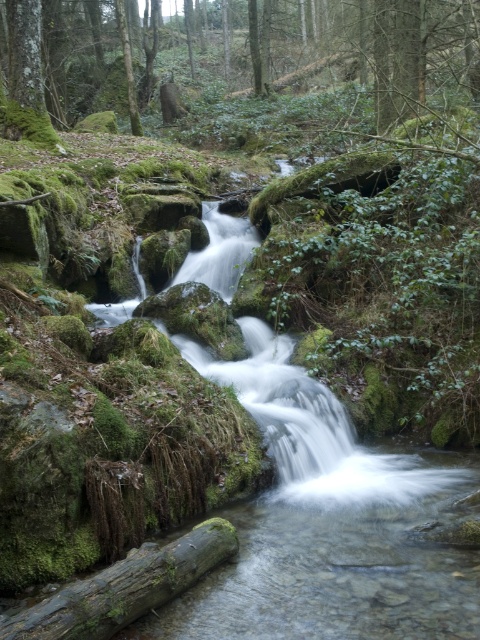
Who is more forward, (x=386, y=83) or (x=220, y=529)?

Point (x=220, y=529)

Can you confirm if green mossy tree at upper center is positioned to the left of green mossy log at lower center?

Indeed, green mossy tree at upper center is positioned on the left side of green mossy log at lower center.

This screenshot has height=640, width=480. What are the coordinates of `green mossy tree at upper center` in the screenshot? It's located at (316, 48).